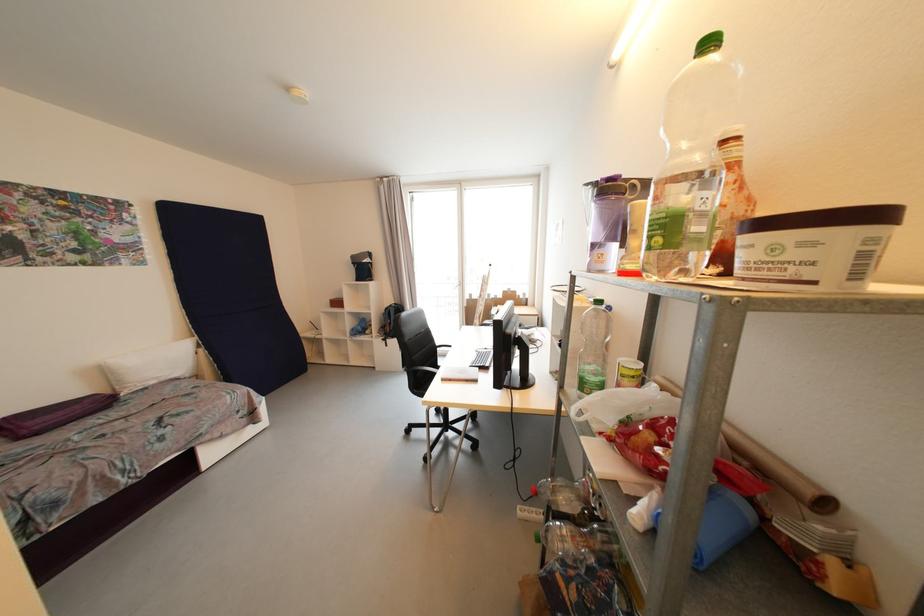
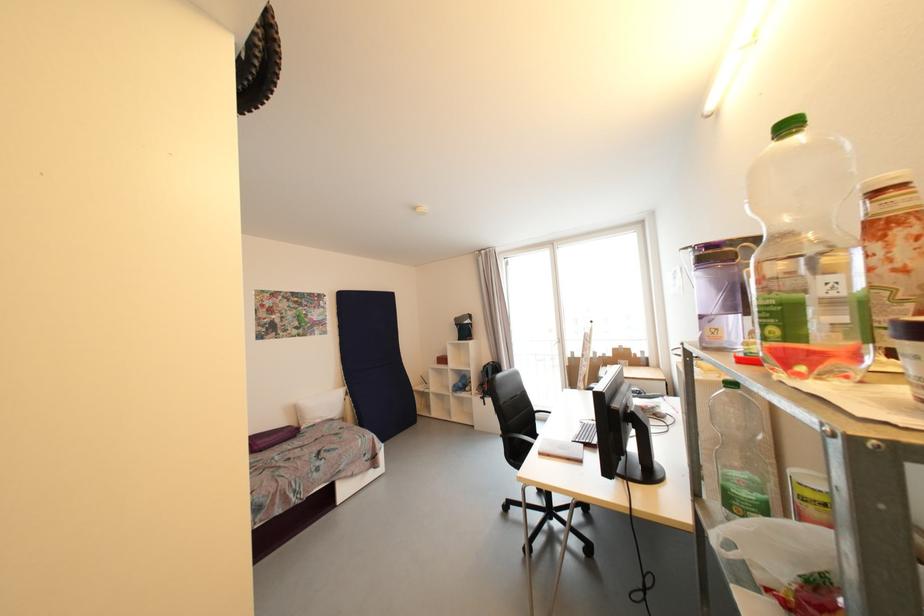
In the second image, find the point that corresponds to the point at 605,379 in the first image.

(763, 498)